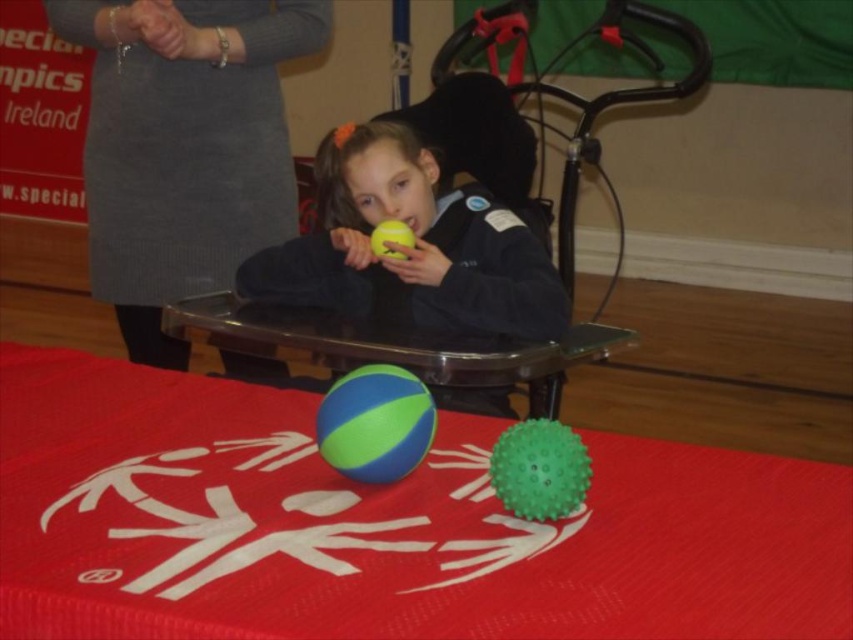
Does point (135, 113) come farther from viewer compared to point (567, 296)?

That is True.

Between point (274, 49) and point (624, 3), which one is positioned in front?

Positioned in front is point (274, 49).

Is point (302, 52) behind point (514, 268)?

Yes.

Where is `gray woolen dress at upper left`? The width and height of the screenshot is (853, 640). gray woolen dress at upper left is located at coordinates (184, 147).

Between gray woolen dress at upper left and transparent plastic table at center, which one is positioned higher?

gray woolen dress at upper left is above.

Does gray woolen dress at upper left have a lesser width compared to transparent plastic table at center?

Indeed, gray woolen dress at upper left has a lesser width compared to transparent plastic table at center.

Image resolution: width=853 pixels, height=640 pixels. Describe the element at coordinates (184, 147) in the screenshot. I see `gray woolen dress at upper left` at that location.

Locate an element on the screen. gray woolen dress at upper left is located at coordinates [184, 147].

Does point (122, 300) lie in front of point (465, 240)?

No, (122, 300) is behind (465, 240).

Is gray woolen dress at upper left positioned behind yellow rubber ball at center?

Yes.

Locate an element on the screen. gray woolen dress at upper left is located at coordinates (184, 147).